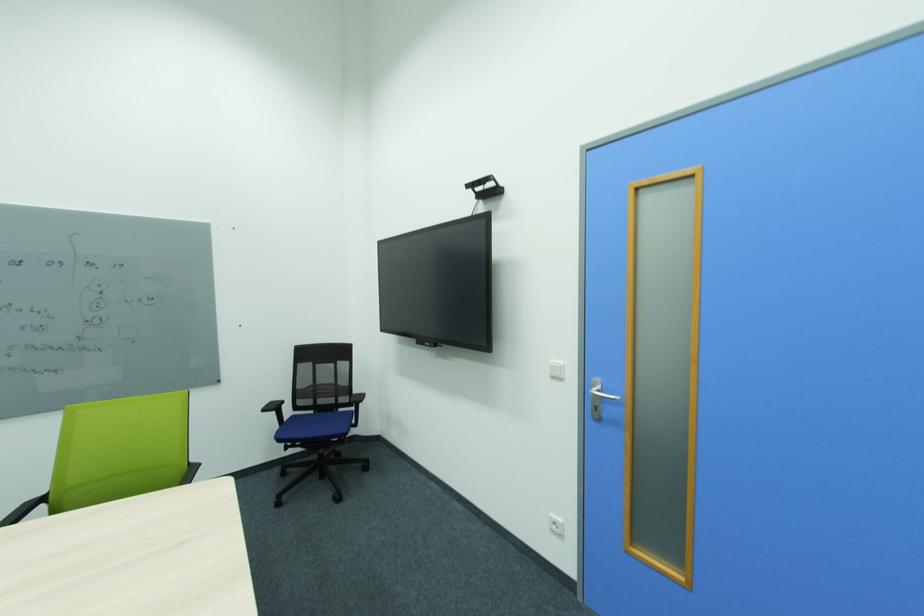
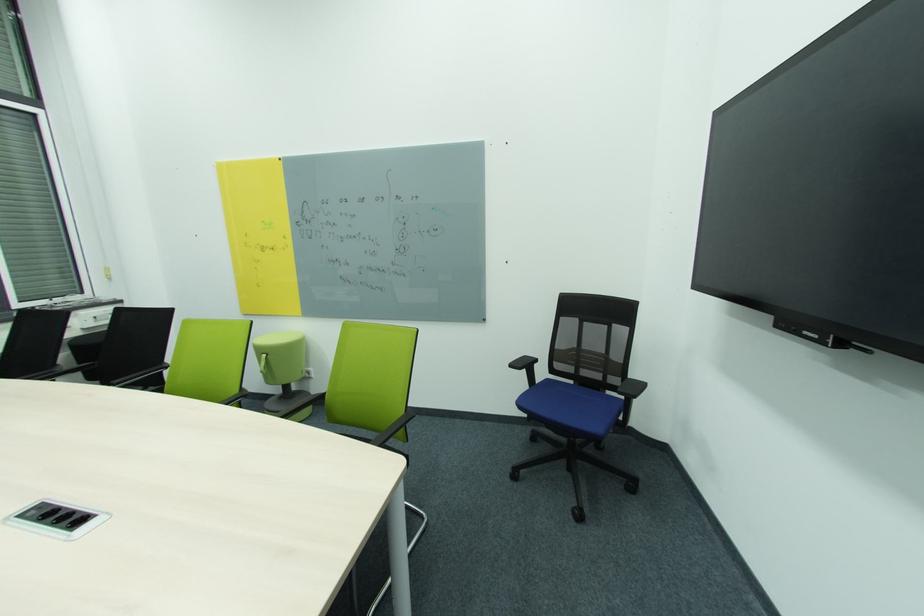
Question: The images are taken continuously from a first-person perspective. In which direction is your viewpoint rotating?

Choices:
 (A) Left
 (B) Right
 (C) Up
 (D) Down

Answer: (A)